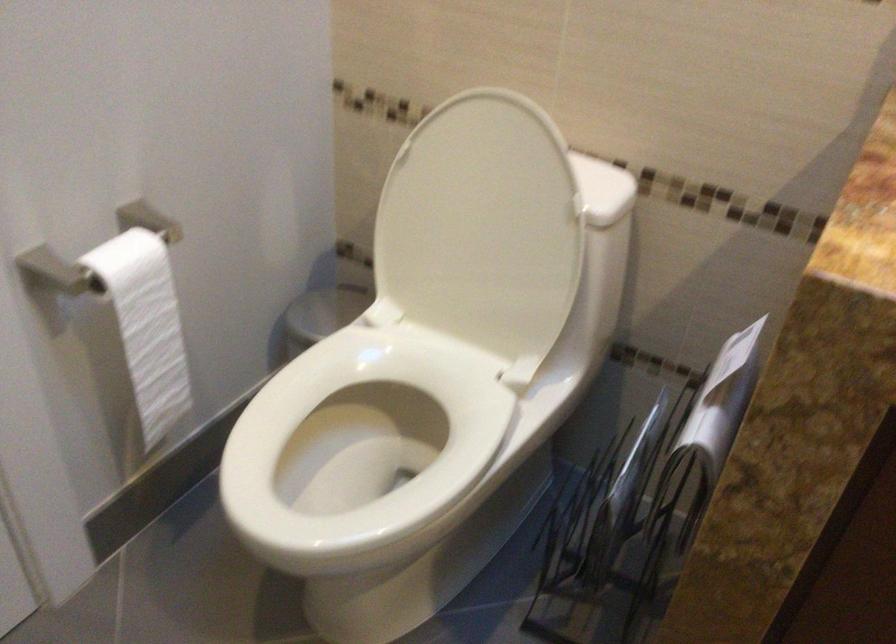
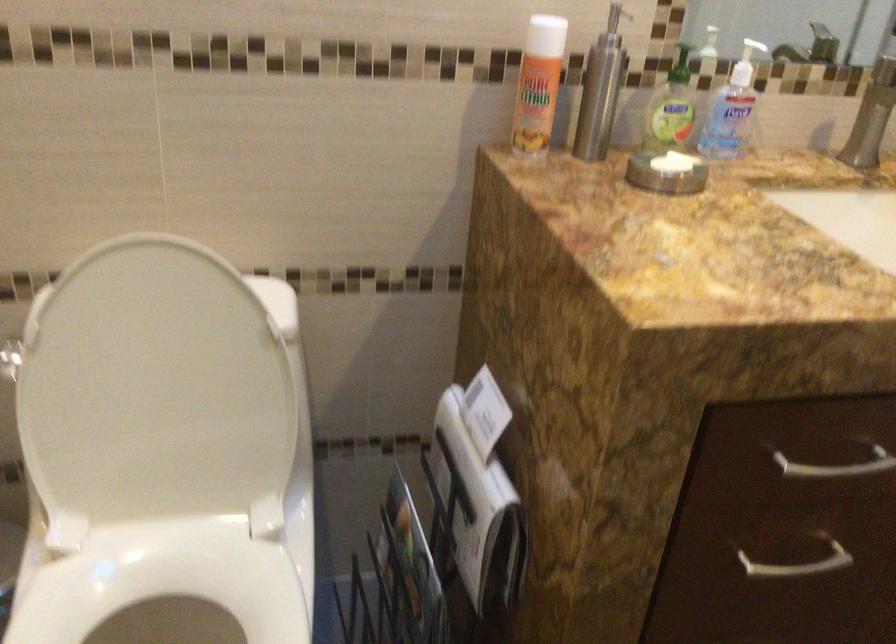
The point at (675, 446) is marked in the first image. Where is the corresponding point in the second image?

(477, 512)